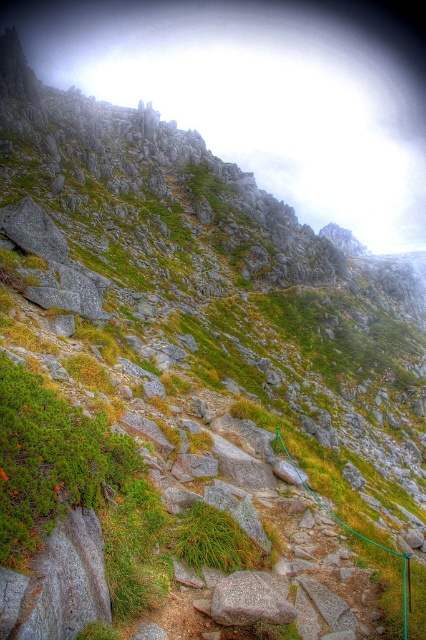
Question: Does granite rock at center appear on the left side of green rubber rope at center?

Choices:
 (A) yes
 (B) no

Answer: (A)

Question: Which point is closer to the camera?

Choices:
 (A) (405, 584)
 (B) (241, 604)

Answer: (B)

Question: Can you confirm if granite rock at center is smaller than green rubber rope at center?

Choices:
 (A) no
 (B) yes

Answer: (B)

Question: Can you confirm if granite rock at center is positioned below green rubber rope at center?

Choices:
 (A) no
 (B) yes

Answer: (A)

Question: Which point is closer to the camera taking this photo?

Choices:
 (A) (222, 579)
 (B) (403, 632)

Answer: (B)